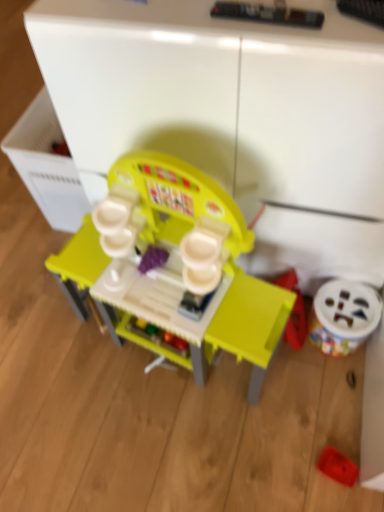
Locate an element on the screen. vacant space that is in between matte plastic play kitchen at center, positioned as the 3th toy in right-to-left order, and rubberized red tray at lower right, the second toy from the right is located at coordinates (281, 411).